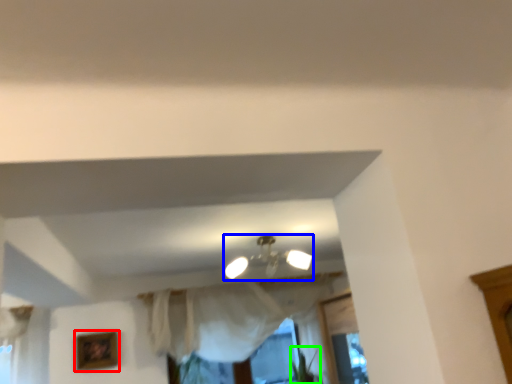
Question: Estimate the real-world distances between objects in this image. Which object is closer to picture frame (highlighted by a red box), lamp (highlighted by a blue box) or plant (highlighted by a green box)?

Choices:
 (A) lamp
 (B) plant

Answer: (A)